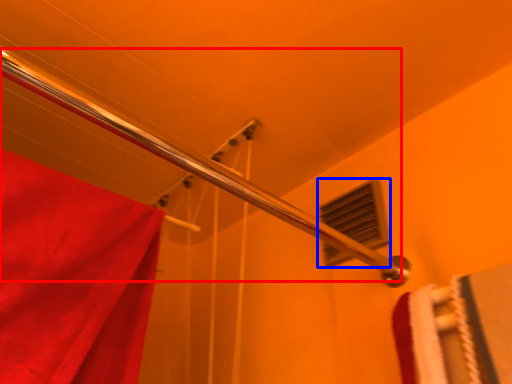
Question: Which object is further to the camera taking this photo, shower (highlighted by a red box) or window (highlighted by a blue box)?

Choices:
 (A) shower
 (B) window

Answer: (B)